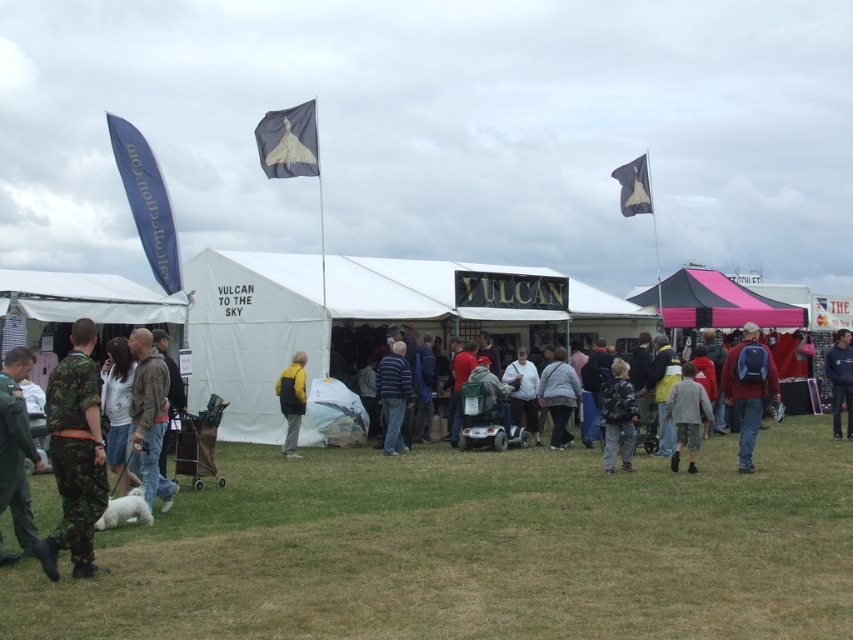
Based on the photo, you are standing at the entrance of the fair and want to take a photo of both the pink fabric canopy at center and the dark blue fabric flag at upper center. Which object should you focus on first to ensure both are in the frame?

You should focus on the pink fabric canopy at center first since it is closer to you than the dark blue fabric flag at upper center, ensuring both remain in the frame by starting with the closer object.

You are a photographer at the event and want to capture both the camouflage uniform at left and the camouflage pants at lower left in a single frame. Which object should you focus on first to ensure both are in the shot?

The camouflage uniform at left is taller than the camouflage pants at lower left, so you should focus on the camouflage uniform at left first to ensure both are in the shot.